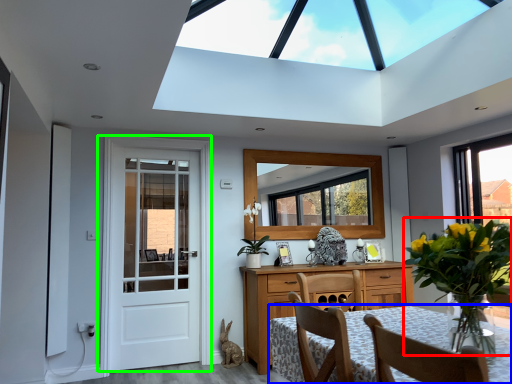
Question: Which is nearer to the floral arrangement (highlighted by a red box)? table (highlighted by a blue box) or door (highlighted by a green box).

Choices:
 (A) table
 (B) door

Answer: (A)